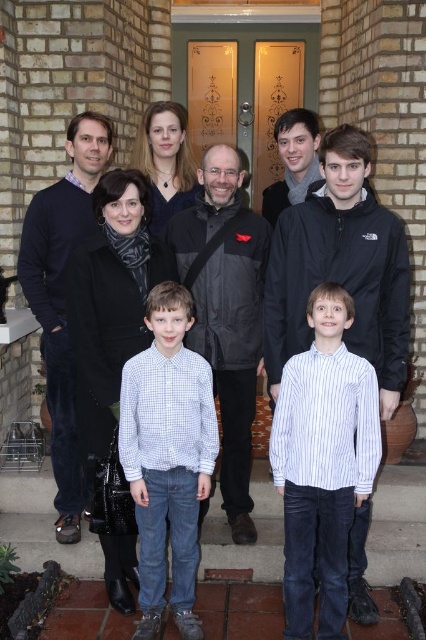
Can you confirm if black matte jacket at center is thinner than dark blue sweater at left?

In fact, black matte jacket at center might be wider than dark blue sweater at left.

Which is behind, point (236, 264) or point (31, 272)?

The point (31, 272) is more distant.

Does point (232, 301) lie behind point (40, 234)?

No, it is not.

The width and height of the screenshot is (426, 640). In order to click on black matte jacket at center in this screenshot , I will do `click(226, 312)`.

Can you confirm if white striped shirt at center is smaller than matte gray scarf at upper center?

Actually, white striped shirt at center might be larger than matte gray scarf at upper center.

Who is positioned more to the right, white striped shirt at center or matte gray scarf at upper center?

From the viewer's perspective, white striped shirt at center appears more on the right side.

In order to click on white striped shirt at center in this screenshot , I will do `click(322, 461)`.

You are a GUI agent. You are given a task and a screenshot of the screen. Output one action in this format:
    pyautogui.click(x=<x>, y=<y>)
    Task: Click on the white striped shirt at center
    The image size is (426, 640).
    Given the screenshot: What is the action you would take?
    pyautogui.click(x=322, y=461)

Can you confirm if white striped shirt at center is shorter than white checkered shirt at center?

Yes.

The image size is (426, 640). What do you see at coordinates (322, 461) in the screenshot?
I see `white striped shirt at center` at bounding box center [322, 461].

The image size is (426, 640). Find the location of `white striped shirt at center`. white striped shirt at center is located at coordinates (322, 461).